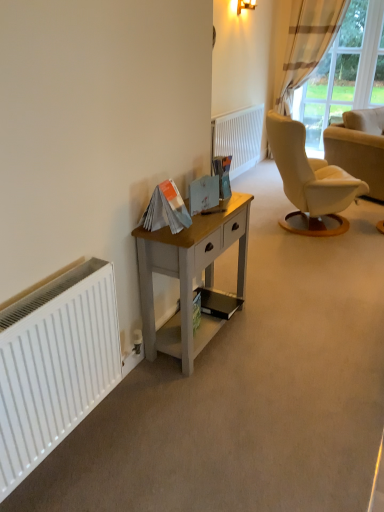
At what (x,y) coordinates should I click in order to perform the action: click on vacant space that's between light gray wood desk at center and white matte radiator at left, which is the first radiator from front to back. Please return your answer as a coordinate pair (x, y). Looking at the image, I should click on (134, 409).